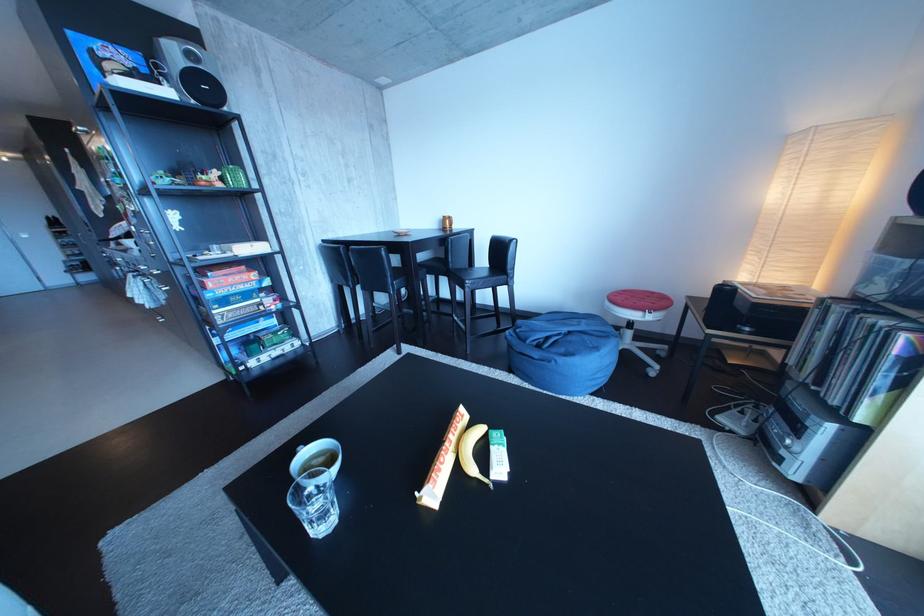
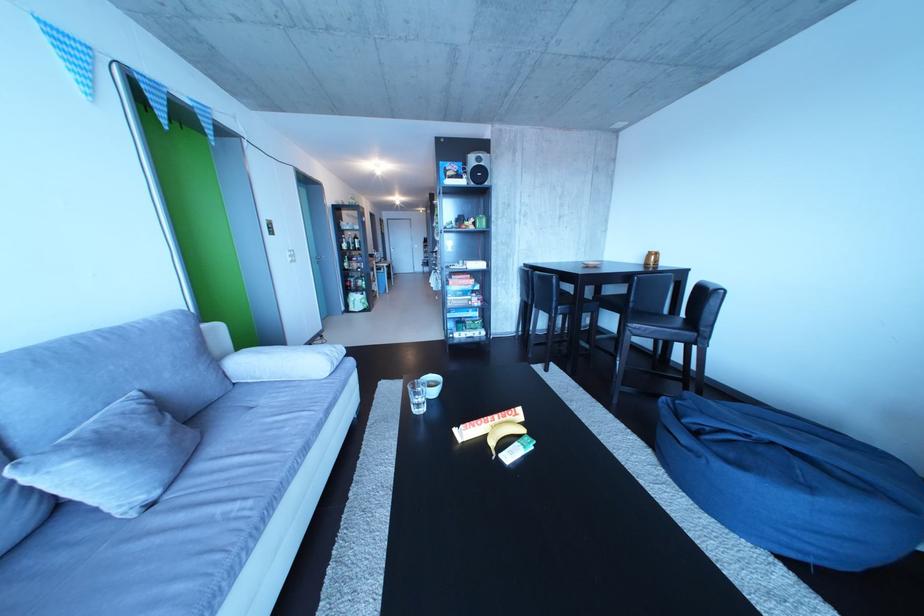
Question: How did the camera likely rotate?

Choices:
 (A) Left
 (B) Right
 (C) Up
 (D) Down

Answer: (A)